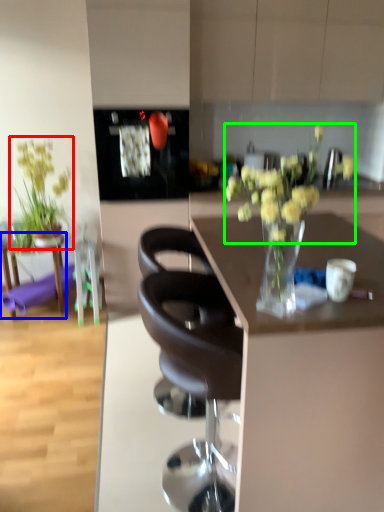
Question: Which is nearer to the houseplant (highlighted by a red box)? table (highlighted by a blue box) or flower (highlighted by a green box).

Choices:
 (A) table
 (B) flower

Answer: (A)